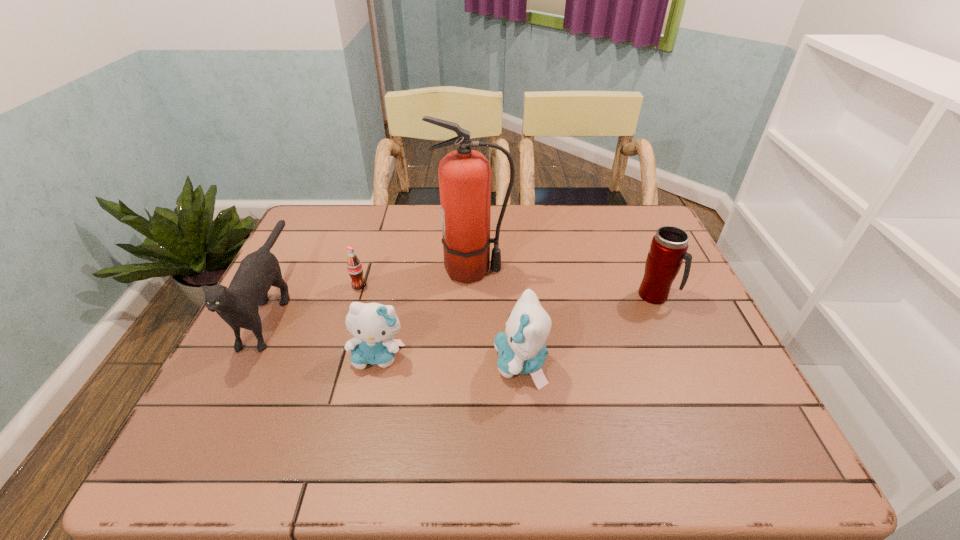
This screenshot has height=540, width=960. I want to click on vacant space situated on the face of the right kitten, so click(x=345, y=363).

Image resolution: width=960 pixels, height=540 pixels. I want to click on vacant area situated 0.370m on the face of the right kitten, so click(x=332, y=363).

Locate an element on the screen. vacant space situated on the front-facing side of the leftmost object is located at coordinates (227, 397).

This screenshot has height=540, width=960. Identify the location of vacant space situated 0.080m on the left of the second object from left to right. (323, 285).

Image resolution: width=960 pixels, height=540 pixels. I want to click on free spot located on the side with the handle of the rightmost object, so click(x=692, y=296).

Locate an element on the screen. Image resolution: width=960 pixels, height=540 pixels. free location located on the nozzle of the tallest object is located at coordinates (601, 271).

Find the location of a particular element. object that is at the near edge is located at coordinates (522, 350).

Locate an element on the screen. object present at the left edge is located at coordinates (238, 305).

Identify the location of object positioned at the right edge. (669, 246).

You are a GUI agent. You are given a task and a screenshot of the screen. Output one action in this format:
    pyautogui.click(x=<x>, y=<y>)
    Task: Click on the free space at the far edge
    Image resolution: width=960 pixels, height=540 pixels.
    Given the screenshot: What is the action you would take?
    pyautogui.click(x=583, y=217)